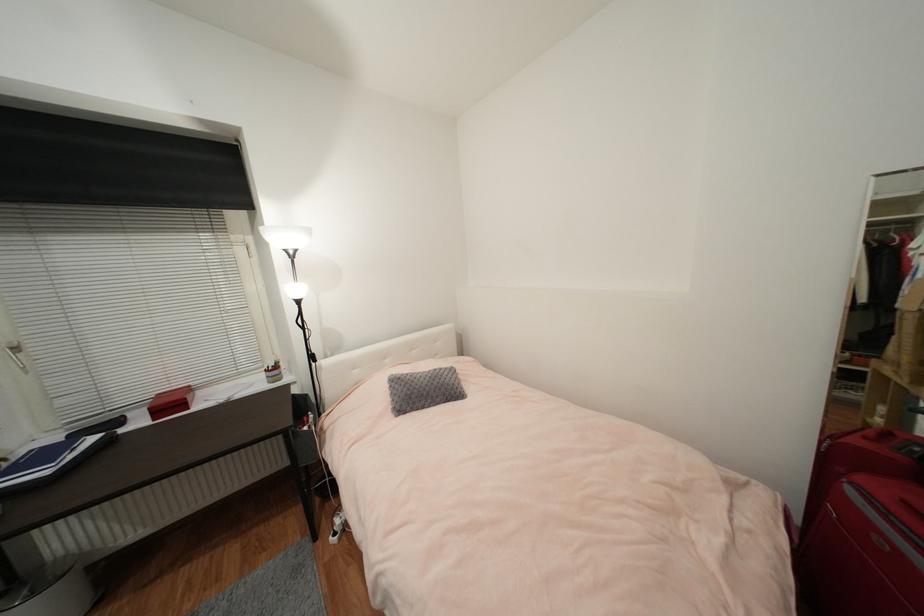
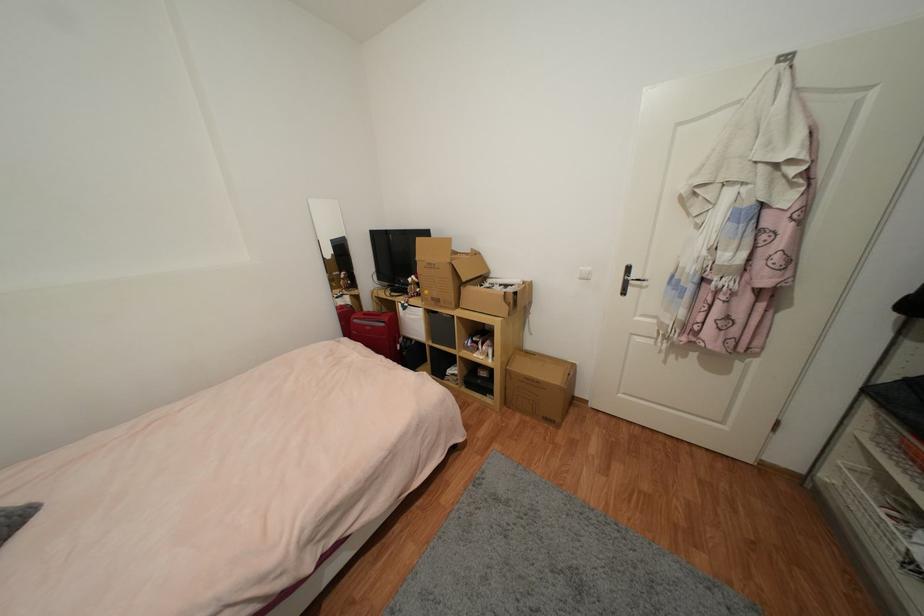
Based on the photo, the first image is from the beginning of the video and the second image is from the end. How did the camera likely rotate when shooting the video?

The camera's rotation is toward right-down.